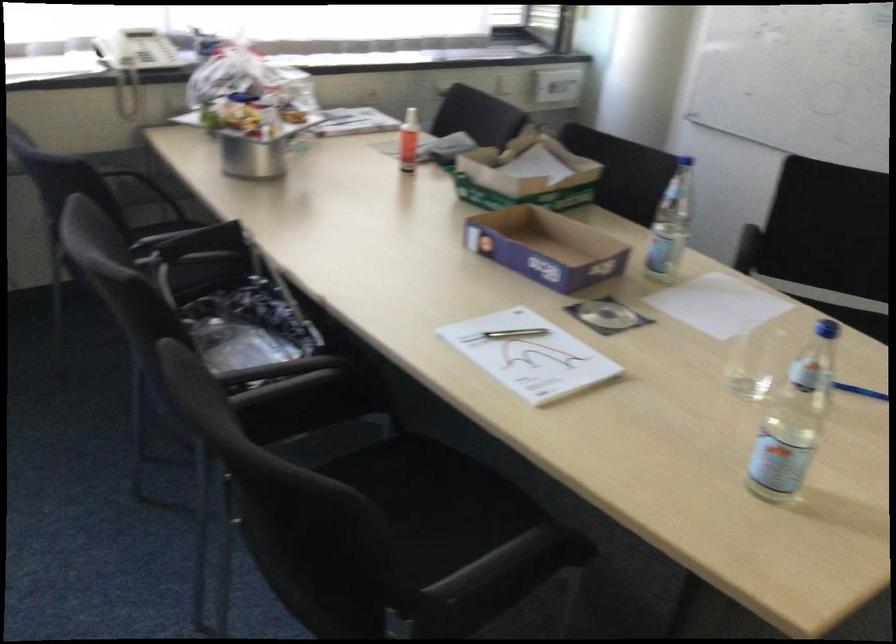
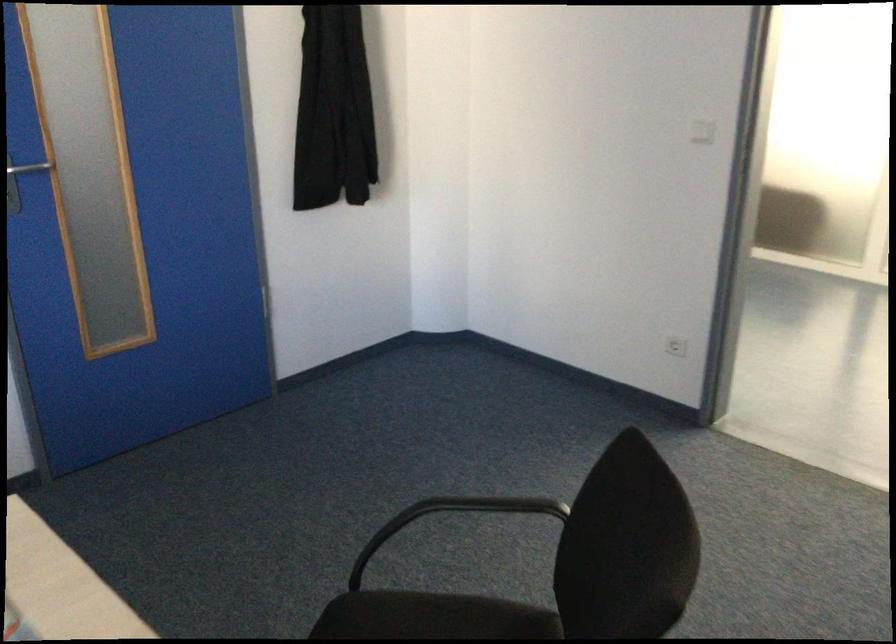
First-person continuous shooting, in which direction is the camera rotating?

The rotation direction of the camera is right-down.